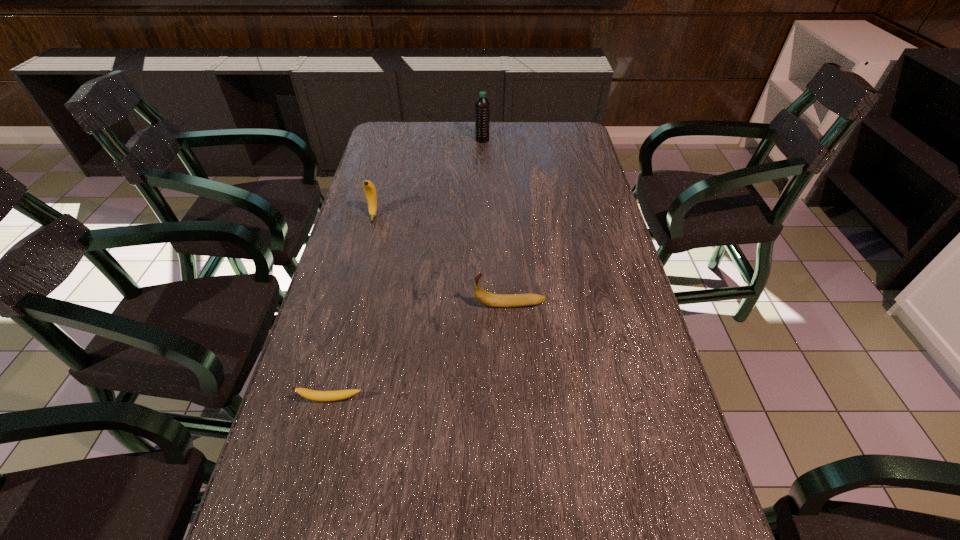
Find the location of `free region located 0.180m at the stem of the third farthest object`. free region located 0.180m at the stem of the third farthest object is located at coordinates (401, 305).

Locate an element on the screen. The height and width of the screenshot is (540, 960). vacant area located at the stem of the third farthest object is located at coordinates coord(329,305).

Locate an element on the screen. vacant space situated 0.090m on the upward curve of the shortest object is located at coordinates (319, 447).

What are the coordinates of `object that is at the far edge` in the screenshot? It's located at (482, 105).

In the image, there is a desktop. Where is `vacant space at the far edge`? vacant space at the far edge is located at coordinates (442, 130).

The height and width of the screenshot is (540, 960). Find the location of `free space at the left edge`. free space at the left edge is located at coordinates (324, 298).

This screenshot has width=960, height=540. In order to click on free spot at the right edge of the desktop in this screenshot , I will do `click(616, 329)`.

Identify the location of vacant space at the far left corner. The image size is (960, 540). (408, 148).

I want to click on blank area at the far right corner, so click(545, 141).

This screenshot has height=540, width=960. Identify the location of free space between the tallest object and the shortest object. [x=407, y=269].